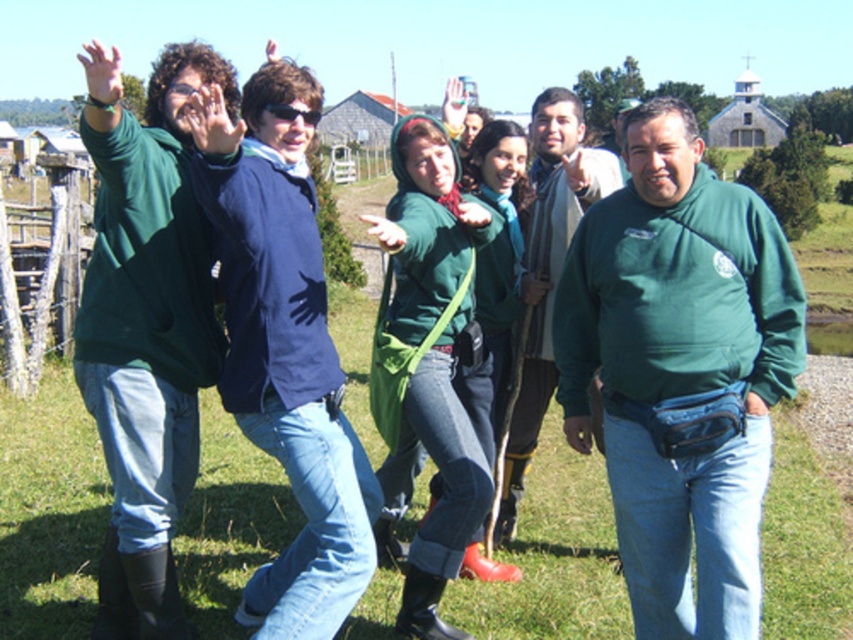
Which is more to the left, green fleece jacket at center or matte green hoodie at center?

Positioned to the left is matte green hoodie at center.

Does green fleece jacket at center appear on the left side of matte green hoodie at center?

In fact, green fleece jacket at center is to the right of matte green hoodie at center.

Is point (572, 292) behind point (515, 404)?

No, it is not.

Find the location of a particular element. The height and width of the screenshot is (640, 853). green fleece jacket at center is located at coordinates (682, 372).

In the scene shown: Can you confirm if green fleece jacket at center is taller than matte blue sweater at center?

No, green fleece jacket at center is not taller than matte blue sweater at center.

Does green fleece jacket at center have a smaller size compared to matte blue sweater at center?

Yes.

Image resolution: width=853 pixels, height=640 pixels. Describe the element at coordinates (682, 372) in the screenshot. I see `green fleece jacket at center` at that location.

The width and height of the screenshot is (853, 640). In order to click on green fleece jacket at center in this screenshot , I will do `click(682, 372)`.

Between green fleece jacket at center and green grass at lower center, which one appears on the right side from the viewer's perspective?

green fleece jacket at center is more to the right.

Who is more forward, [741,506] or [546,424]?

Point [741,506] is more forward.

Between point (634, 620) and point (53, 605), which one is positioned in front?

Point (634, 620) is in front.

Locate an element on the screen. green fleece jacket at center is located at coordinates (682, 372).